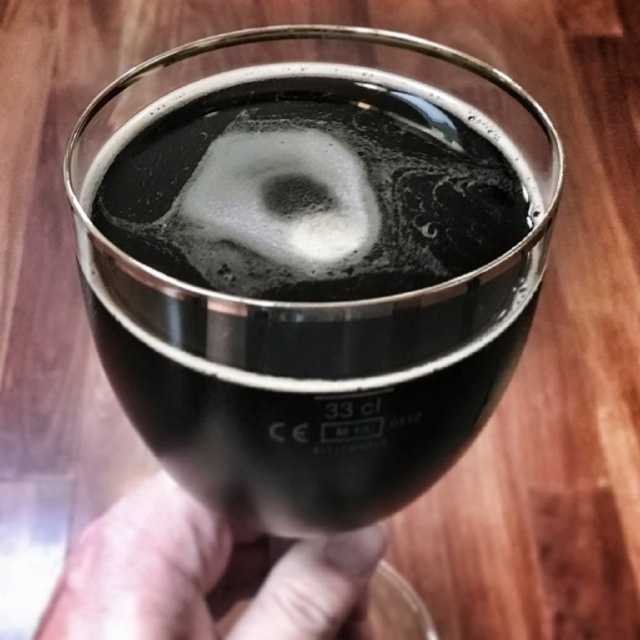
You are holding a smartphone and want to take a photo of the shiny black glass at center and the white frothy foam at center. Which object will appear larger in the photo?

The shiny black glass at center will appear larger in the photo because it is closer to the viewer than the white frothy foam at center.

You are a bartender observing a customer holding a glass of beer. The customer has a skinny white hand at lower center and there is white frothy foam at center. Can you tell me which object is closer to you, the hand or the foam?

The skinny white hand at lower center is closer to you because the white frothy foam at center is behind it.

In the scene shown: You are a bartender trying to place the shiny black glass at center on the counter next to the skinny white hand at lower center. Can you fit both items side by side without overlapping?

The shiny black glass at center is bigger than the skinny white hand at lower center, so they might overlap if placed side by side. Ensure there is enough space between them to avoid overlapping.